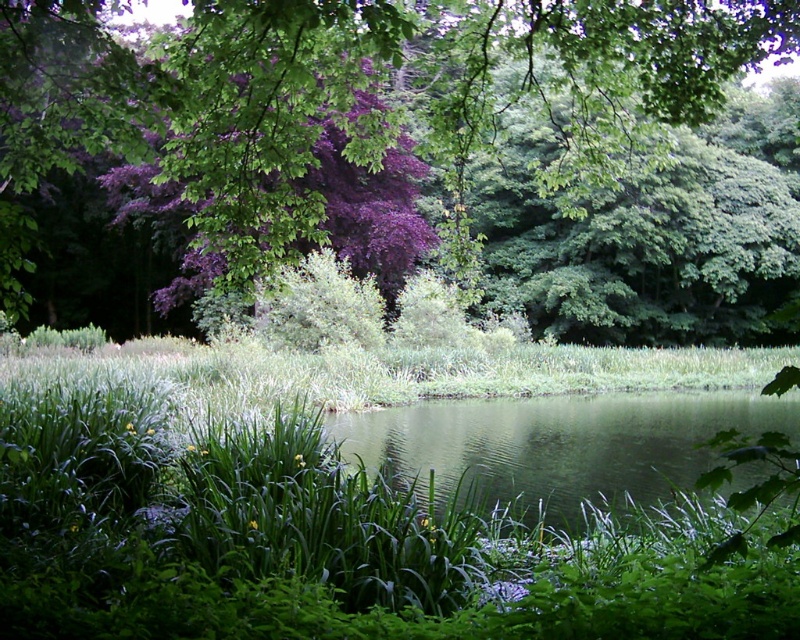
Is point (742, 68) farther from viewer compared to point (404, 454)?

That is True.

Does purple leafy tree at upper center have a larger size compared to green liquid at center?

Correct, purple leafy tree at upper center is larger in size than green liquid at center.

Is point (486, 52) in front of point (670, 445)?

Yes, point (486, 52) is closer to viewer.

This screenshot has width=800, height=640. I want to click on purple leafy tree at upper center, so click(392, 150).